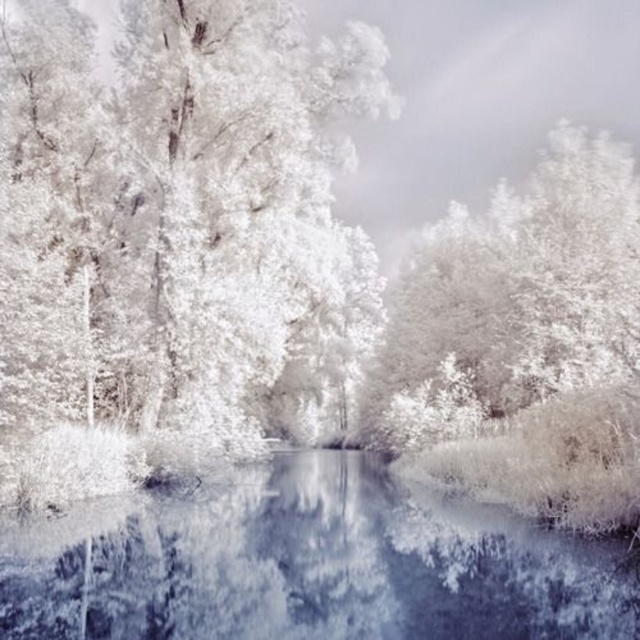
Question: Which object is farther from the camera taking this photo?

Choices:
 (A) translucent ice at center
 (B) white frosty tree at left

Answer: (B)

Question: Does white frosty tree at left appear under translucent ice at center?

Choices:
 (A) yes
 (B) no

Answer: (B)

Question: Which point is closer to the camera?

Choices:
 (A) white frosty tree at left
 (B) translucent ice at center

Answer: (B)

Question: Is white frosty tree at left thinner than translucent ice at center?

Choices:
 (A) yes
 (B) no

Answer: (B)

Question: Where is white frosty tree at left located in relation to translucent ice at center in the image?

Choices:
 (A) above
 (B) below

Answer: (A)